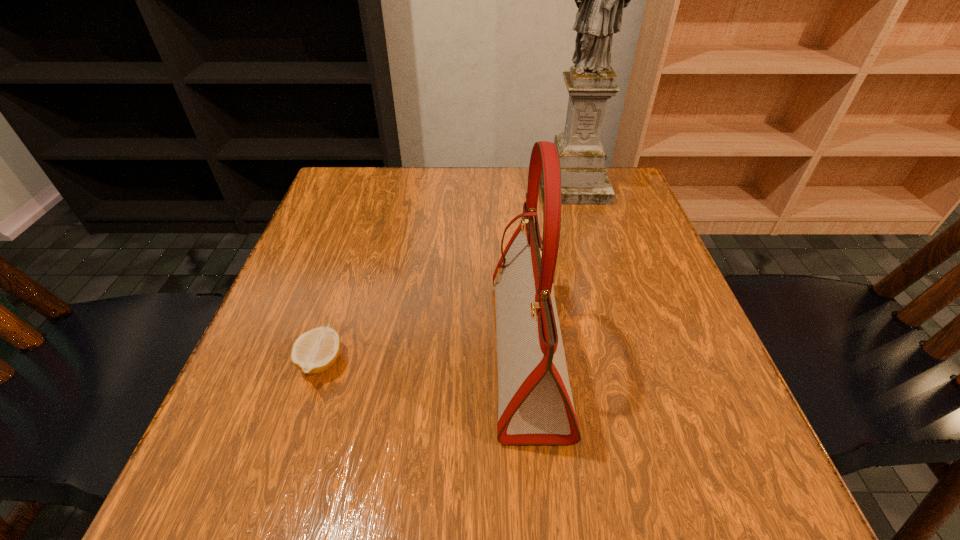
Locate an element on the screen. The image size is (960, 540). sculpture is located at coordinates tap(600, 0).

You are a GUI agent. You are given a task and a screenshot of the screen. Output one action in this format:
    pyautogui.click(x=<x>, y=<y>)
    Task: Click on the tallest object
    This screenshot has width=960, height=540.
    Given the screenshot: What is the action you would take?
    pyautogui.click(x=600, y=0)

Locate an element on the screen. This screenshot has height=540, width=960. the second shortest object is located at coordinates (535, 406).

This screenshot has width=960, height=540. Find the location of `handbag`. handbag is located at coordinates (535, 406).

Locate an element on the screen. The width and height of the screenshot is (960, 540). the shortest object is located at coordinates (314, 351).

Image resolution: width=960 pixels, height=540 pixels. I want to click on lemon, so click(x=314, y=351).

At what (x,y) coordinates should I click in order to perform the action: click on blank space located on the front-facing side of the tallest object. Please return your answer as a coordinate pair (x, y). Image resolution: width=960 pixels, height=540 pixels. Looking at the image, I should click on (596, 266).

Find the location of a particular element. vacant area situated on the right of the second object from right to left is located at coordinates click(x=621, y=353).

This screenshot has height=540, width=960. I want to click on vacant space situated 0.070m on the left of the leftmost object, so click(x=258, y=362).

This screenshot has width=960, height=540. Find the location of `object that is at the far edge`. object that is at the far edge is located at coordinates (600, 0).